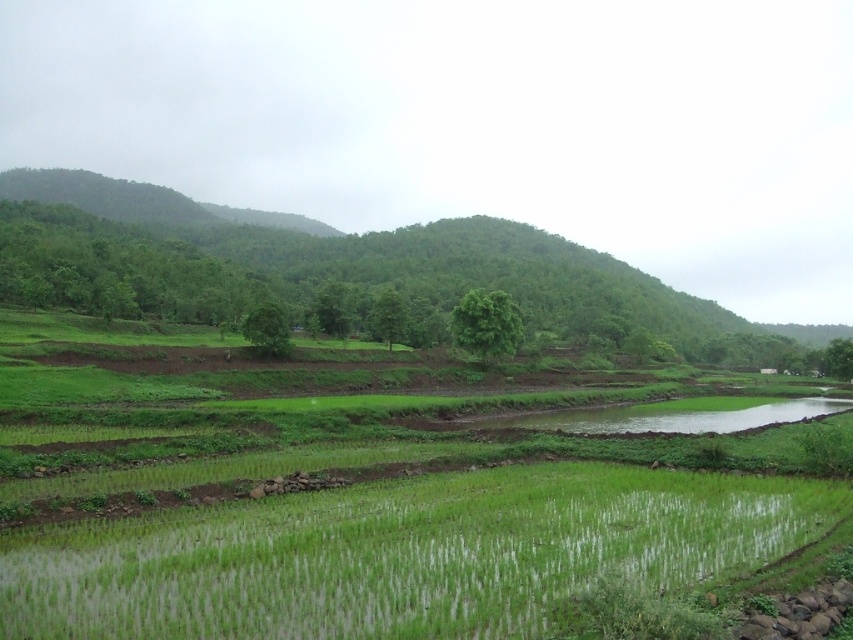
Where is `green grassy rice field at lower center`? green grassy rice field at lower center is located at coordinates (402, 554).

Between green grassy rice field at lower center and green leafy hillside at center, which one appears on the left side from the viewer's perspective?

From the viewer's perspective, green grassy rice field at lower center appears more on the left side.

Between point (548, 579) and point (86, 211), which one is positioned behind?

The point (86, 211) is more distant.

At what (x,y) coordinates should I click in order to perform the action: click on green grassy rice field at lower center. Please return your answer as a coordinate pair (x, y). Looking at the image, I should click on (402, 554).